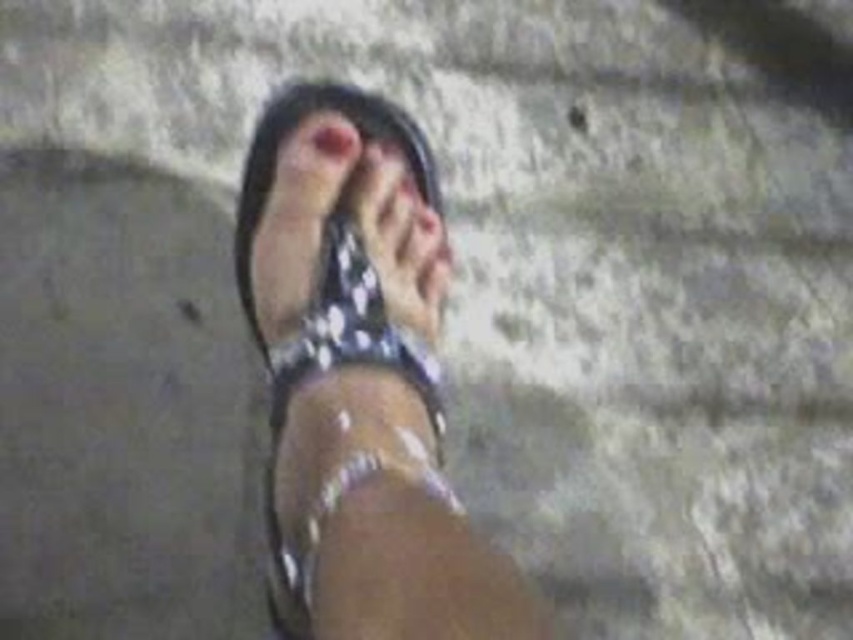
Can you confirm if shiny metallic sandal at center is positioned to the left of matte black sandal at center?

In fact, shiny metallic sandal at center is to the right of matte black sandal at center.

From the picture: Between shiny metallic sandal at center and matte black sandal at center, which one has less height?

With less height is matte black sandal at center.

Is point (334, 324) behind point (415, 144)?

No, (334, 324) is closer to viewer.

Locate an element on the screen. The image size is (853, 640). shiny metallic sandal at center is located at coordinates (360, 380).

Who is higher up, matte black sandal at center or pink matte toe at center?

pink matte toe at center is higher up.

Between point (389, 140) and point (347, 147), which one is positioned in front?

Point (347, 147) is in front.

Which is behind, point (335, 84) or point (328, 128)?

The point (335, 84) is behind.

The width and height of the screenshot is (853, 640). I want to click on matte black sandal at center, so (297, 125).

Is shiny metallic sandal at center to the right of pink matte toe at center from the viewer's perspective?

Yes, shiny metallic sandal at center is to the right of pink matte toe at center.

Between point (401, 156) and point (350, 147), which one is positioned behind?

The point (401, 156) is more distant.

This screenshot has width=853, height=640. I want to click on shiny metallic sandal at center, so click(x=360, y=380).